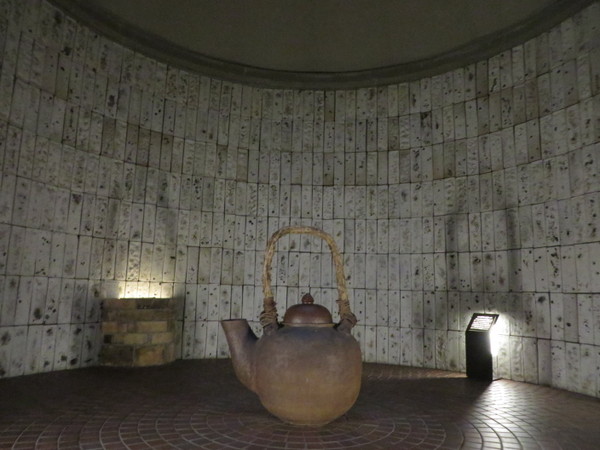
Identify the location of ceiling. click(x=345, y=18).